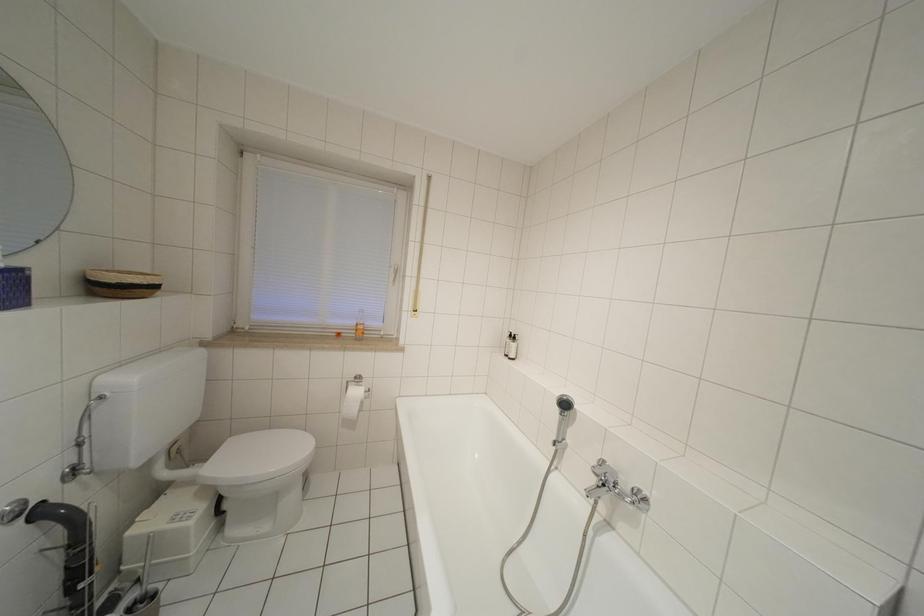
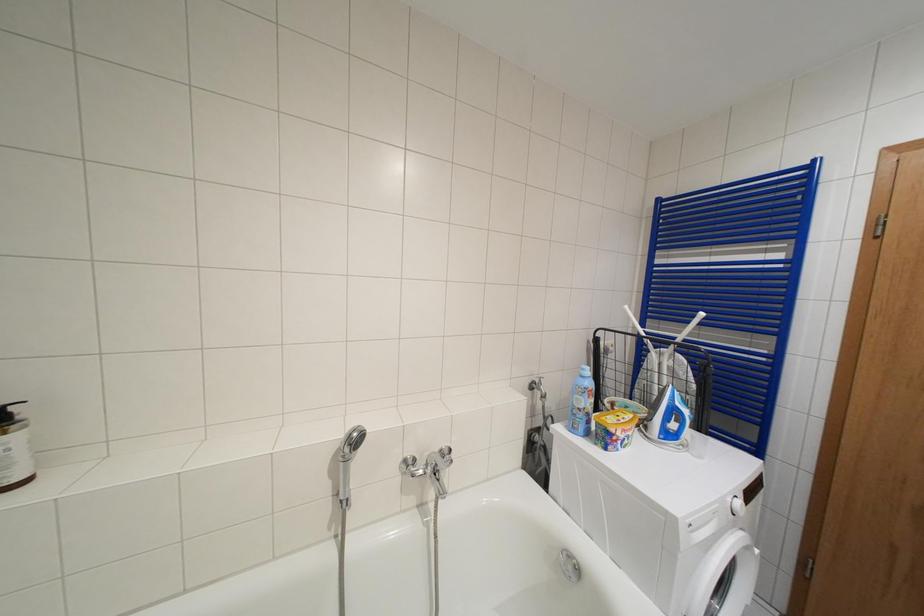
Question: The camera is either moving clockwise (left) or counter-clockwise (right) around the object. The first image is from the beginning of the video and the second image is from the end. Is the camera moving left or right when shooting the video?

Choices:
 (A) Left
 (B) Right

Answer: (A)